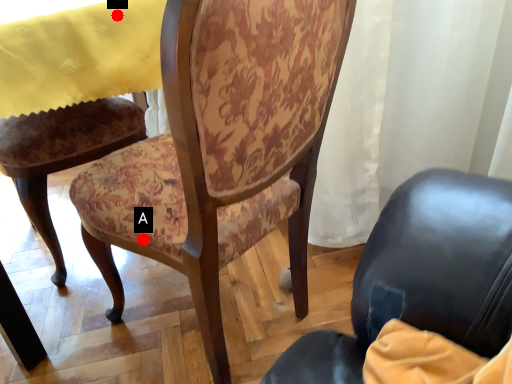
Question: Two points are circled on the image, labeled by A and B beside each circle. Which of the following is the closest to the observer?

Choices:
 (A) A is closer
 (B) B is closer

Answer: (A)